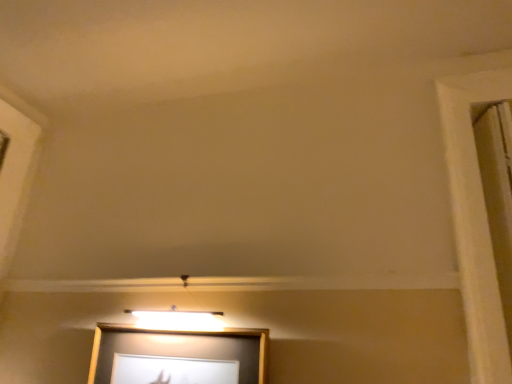
This screenshot has height=384, width=512. What do you see at coordinates (182, 351) in the screenshot? I see `wooden picture frame at center` at bounding box center [182, 351].

Where is `wooden picture frame at center`? The width and height of the screenshot is (512, 384). wooden picture frame at center is located at coordinates (182, 351).

Describe the element at coordinates (474, 221) in the screenshot. The width and height of the screenshot is (512, 384). I see `white wood window frame at right` at that location.

Locate an element on the screen. The width and height of the screenshot is (512, 384). white wood window frame at right is located at coordinates (x=474, y=221).

At what (x,y) coordinates should I click in order to perform the action: click on wooden picture frame at center. Please return your answer as a coordinate pair (x, y). This screenshot has height=384, width=512. Looking at the image, I should click on (182, 351).

Considering the positions of objects wooden picture frame at center and white wood window frame at right in the image provided, who is more to the right, wooden picture frame at center or white wood window frame at right?

Positioned to the right is white wood window frame at right.

Which is in front, wooden picture frame at center or white wood window frame at right?

white wood window frame at right.

Which is closer to the camera, (234, 345) or (479, 180)?

The point (234, 345) is in front.

From the image's perspective, would you say wooden picture frame at center is positioned over white wood window frame at right?

No.

From a real-world perspective, is wooden picture frame at center above or below white wood window frame at right?

From a real-world perspective, wooden picture frame at center is physically below white wood window frame at right.

In the scene shown: Between wooden picture frame at center and white wood window frame at right, which one has smaller width?

white wood window frame at right.

From their relative heights in the image, would you say wooden picture frame at center is taller or shorter than white wood window frame at right?

Clearly, wooden picture frame at center is shorter compared to white wood window frame at right.

Consider the image. Can you confirm if wooden picture frame at center is bigger than white wood window frame at right?

Indeed, wooden picture frame at center has a larger size compared to white wood window frame at right.

In the scene shown: Is wooden picture frame at center inside or outside of white wood window frame at right?

wooden picture frame at center is spatially situated outside white wood window frame at right.

Is there a large distance between wooden picture frame at center and white wood window frame at right?

No, wooden picture frame at center is not far away from white wood window frame at right.

Is wooden picture frame at center oriented towards white wood window frame at right?

No.

What's the angular difference between wooden picture frame at center and white wood window frame at right's facing directions?

The facing directions of wooden picture frame at center and white wood window frame at right are 0.185 degrees apart.

At what (x,y) coordinates should I click in order to perform the action: click on picture frame directly beneath the white wood window frame at right (from a real-world perspective). Please return your answer as a coordinate pair (x, y). This screenshot has height=384, width=512. Looking at the image, I should click on (182, 351).

Does white wood window frame at right appear on the left side of wooden picture frame at center?

Incorrect, white wood window frame at right is not on the left side of wooden picture frame at center.

Which is behind, white wood window frame at right or wooden picture frame at center?

wooden picture frame at center is behind.

Which is nearer, [476,99] or [130,339]?

Positioned in front is point [130,339].

From the image's perspective, between white wood window frame at right and wooden picture frame at center, who is located below?

From the image's view, wooden picture frame at center is below.

From a real-world perspective, who is located lower, white wood window frame at right or wooden picture frame at center?

In real-world perspective, wooden picture frame at center is lower.

Does white wood window frame at right have a lesser width compared to wooden picture frame at center?

Yes, white wood window frame at right is thinner than wooden picture frame at center.

Can you confirm if white wood window frame at right is taller than wooden picture frame at center?

Indeed, white wood window frame at right has a greater height compared to wooden picture frame at center.

Who is bigger, white wood window frame at right or wooden picture frame at center?

With larger size is wooden picture frame at center.

Looking at this image, is white wood window frame at right inside or outside of wooden picture frame at center?

white wood window frame at right is not inside wooden picture frame at center, it's outside.

Consider the image. Would you say white wood window frame at right is a long distance from wooden picture frame at center?

Actually, white wood window frame at right and wooden picture frame at center are a little close together.

Could you tell me if white wood window frame at right is turned towards wooden picture frame at center?

No, white wood window frame at right does not turn towards wooden picture frame at center.

What's the angular difference between white wood window frame at right and wooden picture frame at center's facing directions?

They differ by 0.185 degrees in their facing directions.

You are a GUI agent. You are given a task and a screenshot of the screen. Output one action in this format:
    pyautogui.click(x=<x>, y=<y>)
    Task: Click on the window frame lying above the wooden picture frame at center (from the image's perspective)
    
    Given the screenshot: What is the action you would take?
    pyautogui.click(x=474, y=221)

Image resolution: width=512 pixels, height=384 pixels. In order to click on window frame above the wooden picture frame at center (from a real-world perspective) in this screenshot , I will do `click(474, 221)`.

This screenshot has width=512, height=384. I want to click on picture frame below the white wood window frame at right (from the image's perspective), so click(182, 351).